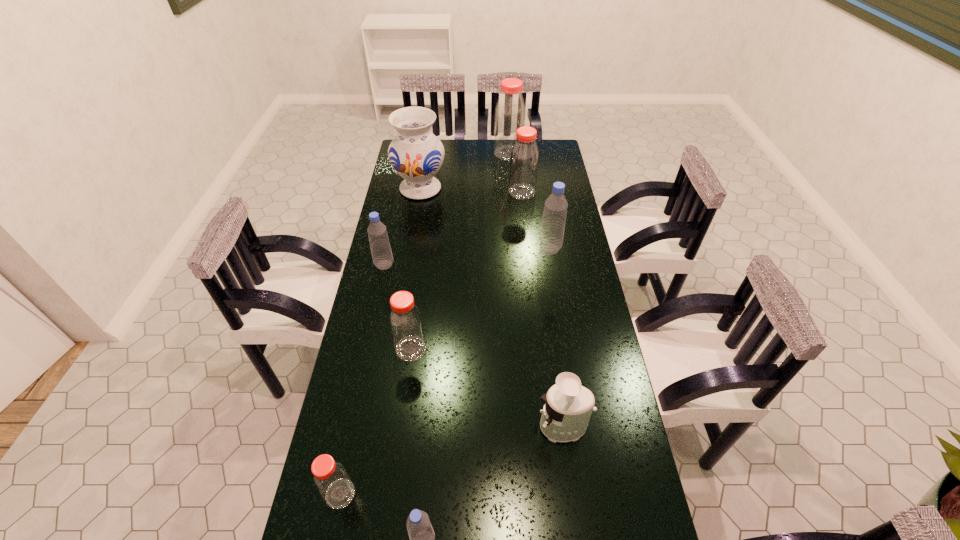
Choose which red bottle is the third nearest neighbor to the second smallest blue bottle. Please provide its 2D coordinates. Your answer should be formatted as a tuple, i.e. [(x, y)], where the tuple contains the x and y coordinates of a point satisfying the conditions above.

[(332, 481)]

Locate which blue bottle ranks in proximity to the leftmost red bottle. Please provide its 2D coordinates. Your answer should be formatted as a tuple, i.e. [(x, y)], where the tuple contains the x and y coordinates of a point satisfying the conditions above.

[(422, 537)]

Image resolution: width=960 pixels, height=540 pixels. I want to click on blue bottle that is the closest to the seventh farthest object, so click(x=422, y=537).

This screenshot has height=540, width=960. In order to click on free location that satisfies the following two spatial constraints: 1. on the front side of the second biggest blue bottle; 2. on the left side of the third nearest object in this screenshot , I will do `click(349, 427)`.